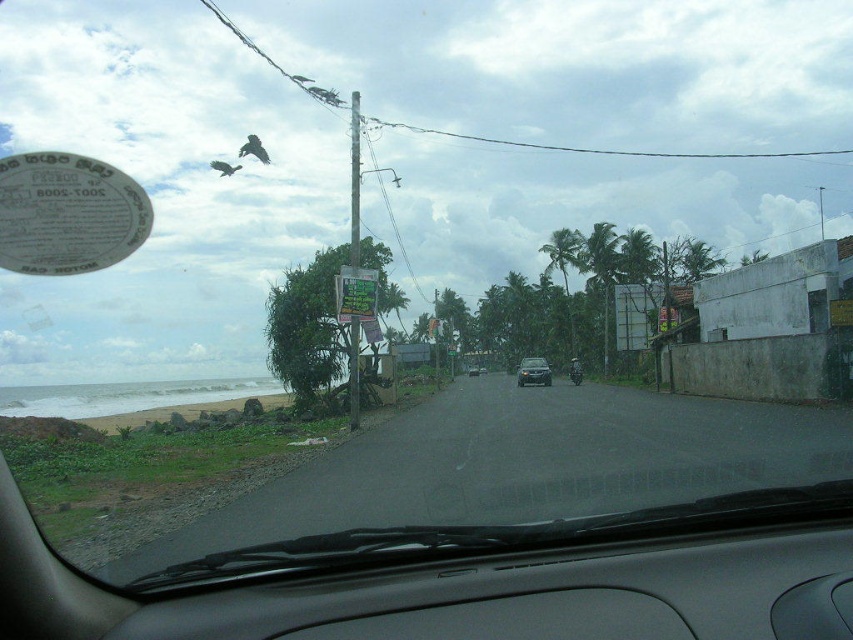
You are driving a car and want to check the speedometer on the black matte dashboard at center. However, there is a satin silver sedan at center in your way. Can you see the speedometer clearly?

The black matte dashboard at center is located above the satin silver sedan at center, so you can see the speedometer clearly because the dashboard is positioned above the sedan and not obstructed by it.

You are driving a car and want to check your speedometer on the black matte dashboard at center. However, there is a satin silver sedan at center blocking your view. Which object should you move to the right to see the speedometer clearly?

The black matte dashboard at center is positioned on the left side of the satin silver sedan at center. To see the speedometer clearly, you should move the satin silver sedan at center to the right so it no longer blocks the view of the black matte dashboard at center.

You are a passenger in the car and want to check the dashboard while keeping an eye on the road ahead. Can you see both the black matte dashboard at center and the satin silver sedan at center at the same time without moving your head?

The black matte dashboard at center is wider than the satin silver sedan at center, so if you look straight ahead, you can see both the black matte dashboard at center and the satin silver sedan at center simultaneously without moving your head.